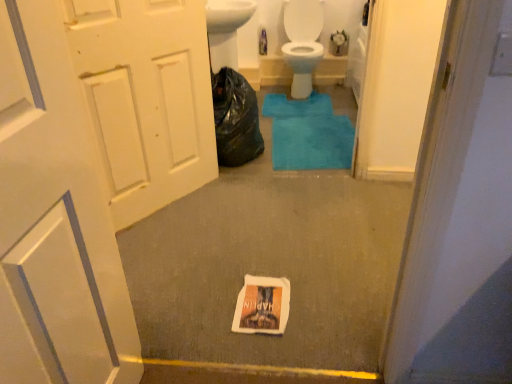
Question: Is black plastic bag at center placed right next to white matte door at left, the first door from the back?

Choices:
 (A) yes
 (B) no

Answer: (B)

Question: Is black plastic bag at center smaller than white matte door at left, which appears as the second door when viewed from the front?

Choices:
 (A) no
 (B) yes

Answer: (A)

Question: Considering the relative sizes of black plastic bag at center and white matte door at left, which appears as the second door when viewed from the front, in the image provided, is black plastic bag at center thinner than white matte door at left, which appears as the second door when viewed from the front,?

Choices:
 (A) yes
 (B) no

Answer: (B)

Question: Considering the relative sizes of black plastic bag at center and white matte door at left, which appears as the second door when viewed from the front, in the image provided, is black plastic bag at center wider than white matte door at left, which appears as the second door when viewed from the front,?

Choices:
 (A) no
 (B) yes

Answer: (B)

Question: Does black plastic bag at center appear on the left side of white matte door at left, the first door from the back?

Choices:
 (A) no
 (B) yes

Answer: (A)

Question: From the image's perspective, does black plastic bag at center appear higher than white matte door at left, the first door from the back?

Choices:
 (A) yes
 (B) no

Answer: (A)

Question: Is white matte door at left, the first door from the back, behind white paper flyer at center?

Choices:
 (A) no
 (B) yes

Answer: (A)

Question: Is white matte door at left, the first door from the back, positioned with its back to white paper flyer at center?

Choices:
 (A) yes
 (B) no

Answer: (B)

Question: Is white matte door at left, which appears as the second door when viewed from the front, located outside white paper flyer at center?

Choices:
 (A) no
 (B) yes

Answer: (B)

Question: Is white matte door at left, the first door from the back, taller than white paper flyer at center?

Choices:
 (A) no
 (B) yes

Answer: (B)

Question: Considering the relative positions of white matte door at left, which appears as the second door when viewed from the front, and white paper flyer at center in the image provided, is white matte door at left, which appears as the second door when viewed from the front, to the right of white paper flyer at center from the viewer's perspective?

Choices:
 (A) no
 (B) yes

Answer: (A)

Question: Does white matte door at left, which appears as the second door when viewed from the front, have a lesser height compared to white paper flyer at center?

Choices:
 (A) no
 (B) yes

Answer: (A)

Question: From a real-world perspective, is white matte door at left, which appears as the second door when viewed from the front, under white matte door at left, arranged as the second door when viewed from the back?

Choices:
 (A) no
 (B) yes

Answer: (B)